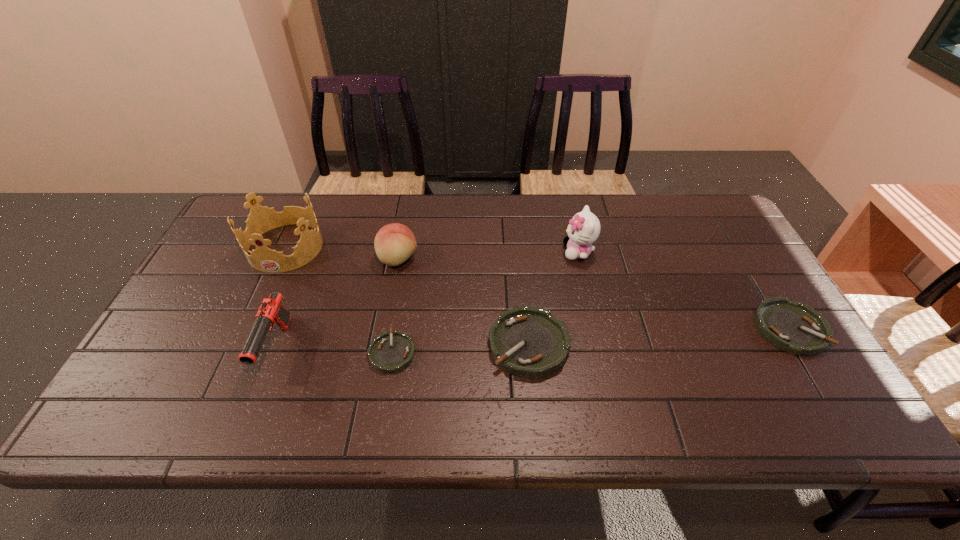
The width and height of the screenshot is (960, 540). Find the location of `vacant area located 0.390m on the right of the third object from right to left`. vacant area located 0.390m on the right of the third object from right to left is located at coordinates (727, 344).

Identify the location of vacant area situated on the left of the sixth tallest object. This screenshot has height=540, width=960. (622, 328).

Identify the location of free location located on the front-facing side of the tiara. (268, 286).

Locate an element on the screen. The width and height of the screenshot is (960, 540). blank area located 0.100m on the front-facing side of the kitten is located at coordinates (529, 252).

At what (x,y) coordinates should I click in order to perform the action: click on free space located 0.320m on the front-facing side of the kitten. Please return your answer as a coordinate pair (x, y). The height and width of the screenshot is (540, 960). Looking at the image, I should click on (456, 252).

Image resolution: width=960 pixels, height=540 pixels. Identify the location of vacant space positioned on the front-facing side of the kitten. (542, 252).

Locate an element on the screen. vacant space located 0.190m on the back of the fourth shortest object is located at coordinates (408, 207).

Identify the location of tiara that is at the far edge. (261, 219).

Find the location of a particular element. The image size is (960, 540). kitten at the far edge is located at coordinates (584, 228).

Locate an element on the screen. The height and width of the screenshot is (540, 960). gun located at the near edge is located at coordinates (271, 311).